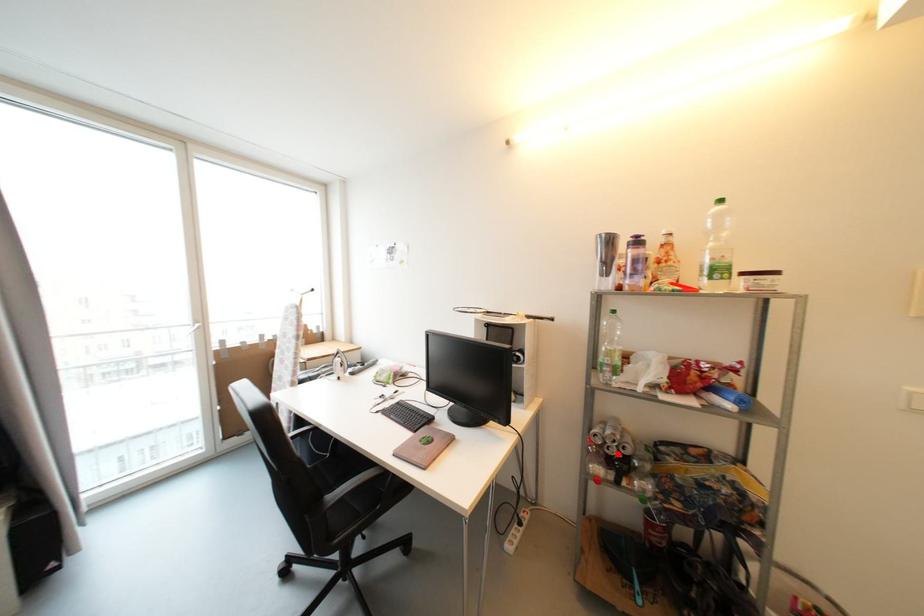
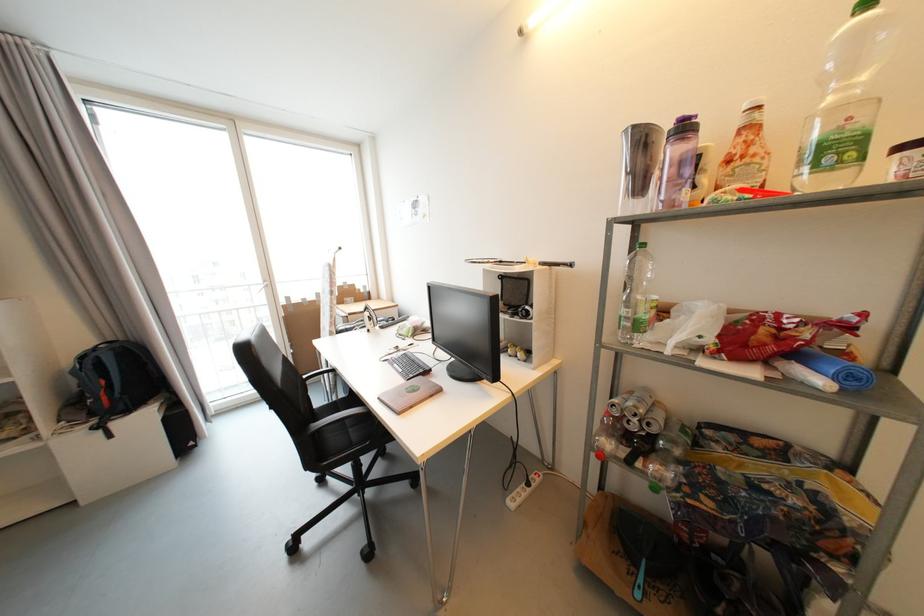
Locate, in the second image, the point that corresponds to the highlighted location in the first image.

(638, 430)